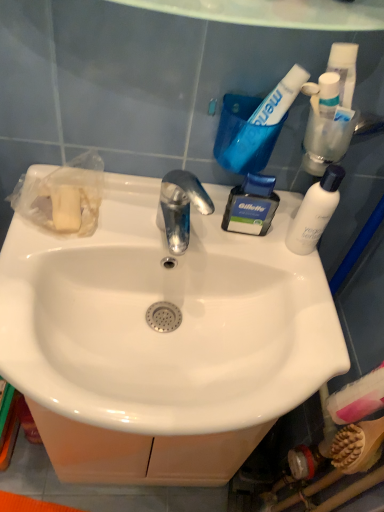
Where is `free spot in front of blue plastic shaving cream at upper right, which is the third toiletry from right to left`? free spot in front of blue plastic shaving cream at upper right, which is the third toiletry from right to left is located at coordinates (277, 280).